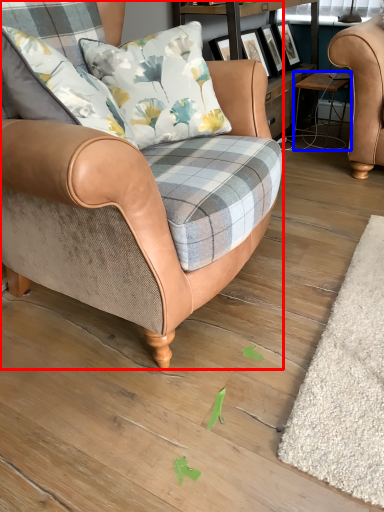
Question: Which object appears farthest to the camera in this image, chair (highlighted by a red box) or stool (highlighted by a blue box)?

Choices:
 (A) chair
 (B) stool

Answer: (B)